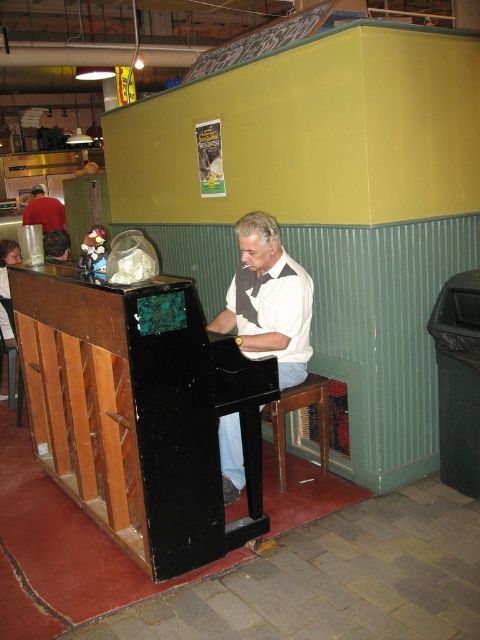
In the scene shown: You are a maintenance worker who needs to move the matte black piano at center and the wooden at center closer together. The minimum distance required between them is 30 centimeters. Is the current distance sufficient?

Answer: The current distance between the matte black piano at center and the wooden at center is 36.01 centimeters, which is more than the required 30 centimeters. Therefore, the current distance is sufficient and does not need adjustment.

You are a photographer standing in the food court. You want to take a photo of the matte black piano at center and the red shirt at left. Which object should you focus on first to ensure both are in the frame?

The matte black piano at center is in front of the red shirt at left, so you should focus on the matte black piano at center first to ensure both are in the frame.